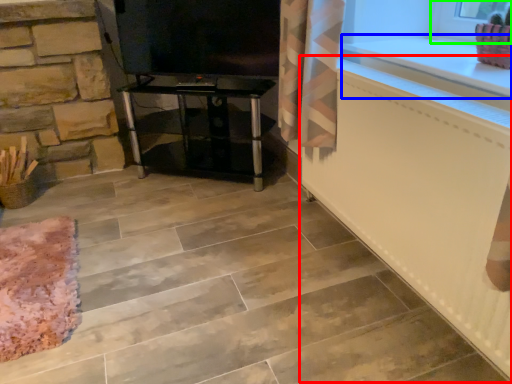
Question: Considering the real-world distances, which object is farthest from radiator (highlighted by a red box)? counter top (highlighted by a blue box) or window frame (highlighted by a green box)?

Choices:
 (A) counter top
 (B) window frame

Answer: (B)